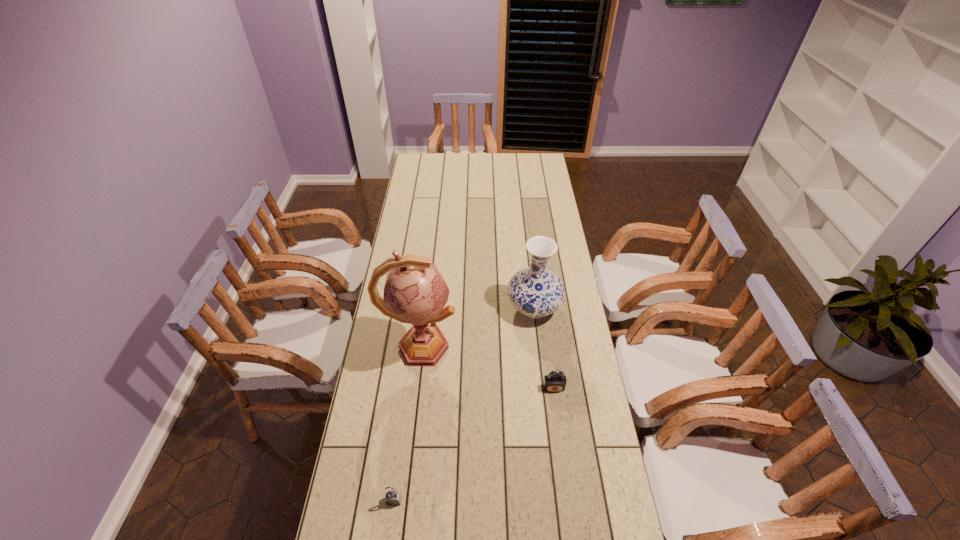
This screenshot has width=960, height=540. I want to click on the tallest object, so click(x=415, y=292).

Locate an element on the screen. This screenshot has height=540, width=960. the third shortest object is located at coordinates (535, 291).

I want to click on the second nearest object, so click(555, 381).

You are a GUI agent. You are given a task and a screenshot of the screen. Output one action in this format:
    pyautogui.click(x=<x>, y=<y>)
    Task: Click on the right padlock
    
    Given the screenshot: What is the action you would take?
    pyautogui.click(x=555, y=381)

The image size is (960, 540). I want to click on the left padlock, so click(x=393, y=498).

The width and height of the screenshot is (960, 540). In order to click on the nearest object in this screenshot , I will do `click(393, 498)`.

I want to click on vacant area located 0.260m on the front-facing side of the tallest object, so point(527,347).

Identify the location of vacant space located on the front of the vase. (544, 401).

At what (x,y) coordinates should I click in order to perform the action: click on free location located on the front of the right padlock near the keyhole. Please return your answer as a coordinate pair (x, y). Looking at the image, I should click on (562, 451).

Locate an element on the screen. The width and height of the screenshot is (960, 540). free space located 0.080m on the shackle of the nearest object is located at coordinates (389, 538).